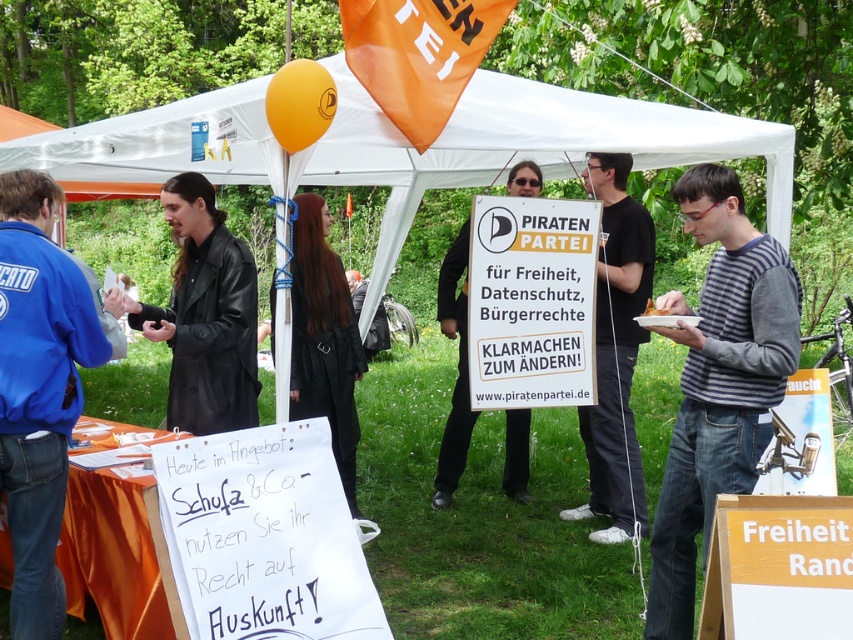
Question: Can you confirm if white paper sign at center is positioned below black matte sign at center?

Choices:
 (A) no
 (B) yes

Answer: (A)

Question: Estimate the real-world distances between objects in this image. Which object is farther from the blue fabric jacket at left?

Choices:
 (A) gray striped sweater at center
 (B) black matte sign at center
 (C) white fabric canopy at upper center
 (D) white paper sign at lower left

Answer: (B)

Question: Is black leather jacket at center above white paper plate at center?

Choices:
 (A) no
 (B) yes

Answer: (A)

Question: Which object appears farthest from the camera in this image?

Choices:
 (A) white paper plate at center
 (B) black leather jacket at center

Answer: (B)

Question: Is white fabric canopy at upper center above black leather coat at center?

Choices:
 (A) yes
 (B) no

Answer: (A)

Question: Which of the following is the farthest from the observer?

Choices:
 (A) black leather jacket at center
 (B) white paper plate at center
 (C) black leather coat at center
 (D) blue fabric jacket at left

Answer: (C)